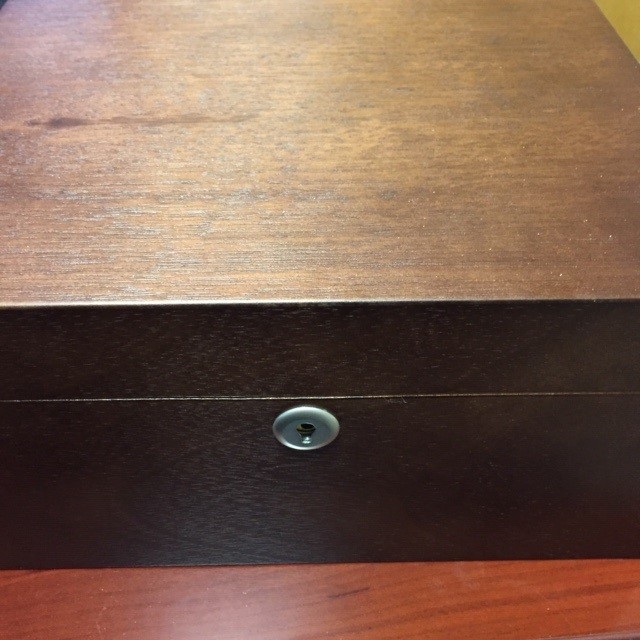
Where is `keyhole`? keyhole is located at coordinates (305, 432).